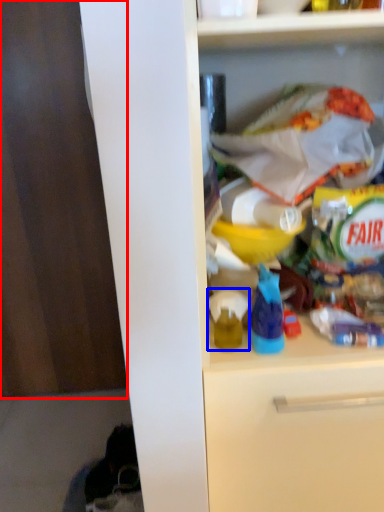
Question: Which of the following is the closest to the observer, leftover (highlighted by a red box) or toy (highlighted by a blue box)?

Choices:
 (A) leftover
 (B) toy

Answer: (B)